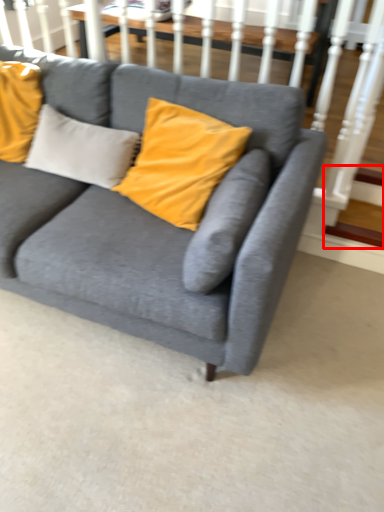
Question: From the image's perspective, considering the relative positions of stairs (annotated by the red box) and studio couch in the image provided, where is stairs (annotated by the red box) located with respect to the staircase?

Choices:
 (A) above
 (B) below

Answer: (B)